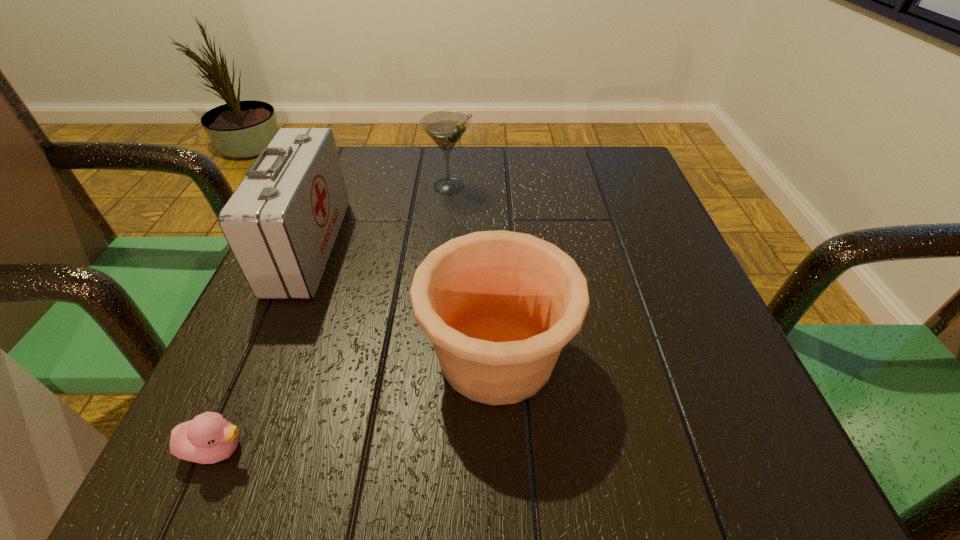
Find the location of a particular element. The image size is (960, 540). the first-aid kit is located at coordinates (281, 223).

This screenshot has height=540, width=960. I want to click on the farthest object, so (445, 128).

This screenshot has height=540, width=960. What are the coordinates of `the third tallest object` in the screenshot? It's located at (499, 306).

The height and width of the screenshot is (540, 960). What are the coordinates of `the nearest object` in the screenshot? It's located at (208, 438).

Find the location of a particular element. duckling is located at coordinates (208, 438).

Locate an element on the screen. vacant space located 0.070m on the front-facing side of the first-aid kit is located at coordinates (372, 246).

Where is `free space located 0.260m on the front of the farthest object`? Image resolution: width=960 pixels, height=540 pixels. free space located 0.260m on the front of the farthest object is located at coordinates (440, 287).

Identify the location of free space located 0.180m on the right of the third tallest object. (696, 355).

Locate an element on the screen. Image resolution: width=960 pixels, height=540 pixels. free space located on the front-facing side of the duckling is located at coordinates (473, 449).

You are a GUI agent. You are given a task and a screenshot of the screen. Output one action in this format:
    pyautogui.click(x=<x>, y=<y>)
    Task: Click on the first-aid kit positioned at the far edge
    This screenshot has height=540, width=960.
    Given the screenshot: What is the action you would take?
    pyautogui.click(x=281, y=223)